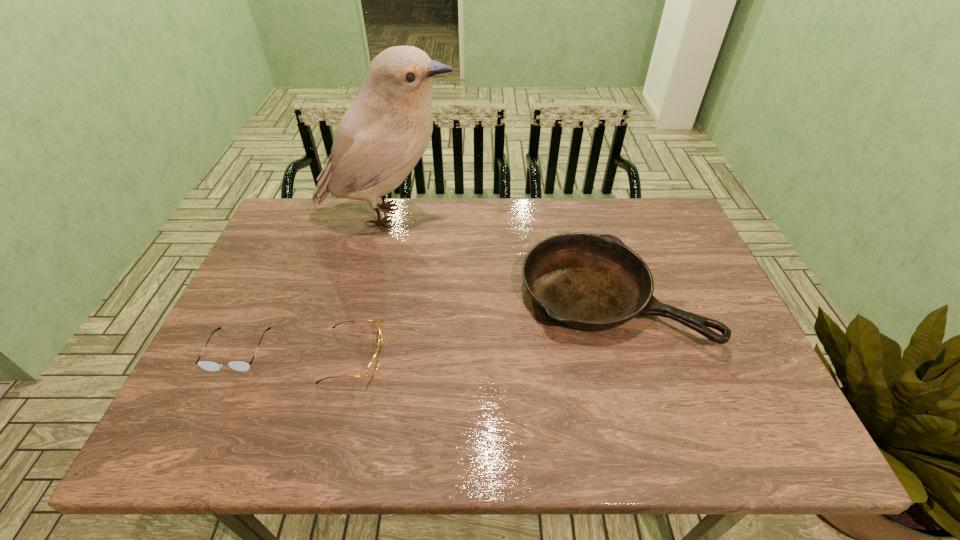
I want to click on the farthest object, so click(x=386, y=130).

At what (x,y) coordinates should I click in order to perform the action: click on the tallest object. Please return your answer as a coordinate pair (x, y). This screenshot has height=540, width=960. Looking at the image, I should click on tap(386, 130).

Locate an element on the screen. The image size is (960, 540). the rightmost object is located at coordinates (593, 282).

This screenshot has height=540, width=960. In order to click on the second tallest object in this screenshot , I will do `click(593, 282)`.

At what (x,y) coordinates should I click in order to perform the action: click on the right spectacles. Please return your answer as a coordinate pair (x, y). This screenshot has height=540, width=960. Looking at the image, I should click on (372, 367).

At what (x,y) coordinates should I click in order to perform the action: click on the shorter spectacles. Please return your answer as a coordinate pair (x, y). This screenshot has height=540, width=960. Looking at the image, I should click on (206, 365).

This screenshot has height=540, width=960. I want to click on the left spectacles, so click(206, 365).

The width and height of the screenshot is (960, 540). Identify the location of blank area located 0.070m on the face of the parakeet. (481, 215).

The image size is (960, 540). I want to click on vacant space located on the front of the second tallest object, so click(643, 414).

Identify the location of vacant space located 0.400m on the front-facing side of the right spectacles. (549, 356).